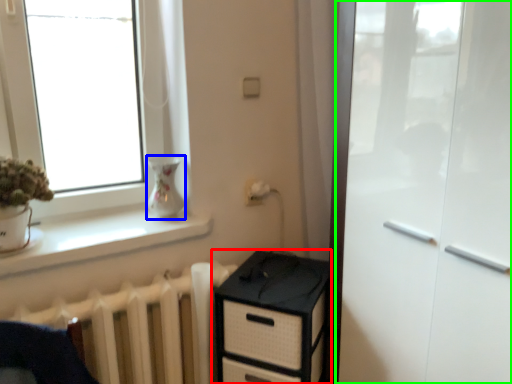
Question: Which is nearer to the chest of drawers (highlighted by a red box)? vase (highlighted by a blue box) or screen door (highlighted by a green box).

Choices:
 (A) vase
 (B) screen door

Answer: (B)